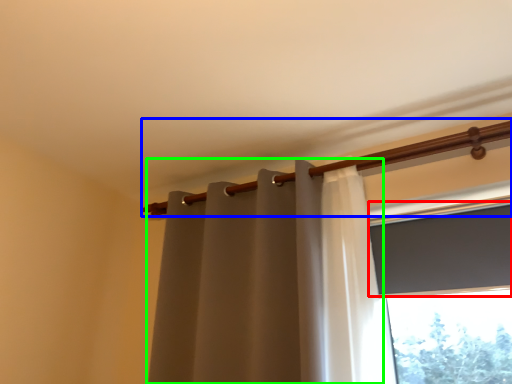
Question: Which object is the farthest from window screen (highlighted by a red box)? Choose among these: beam (highlighted by a blue box) or curtain (highlighted by a green box).

Choices:
 (A) beam
 (B) curtain

Answer: (B)